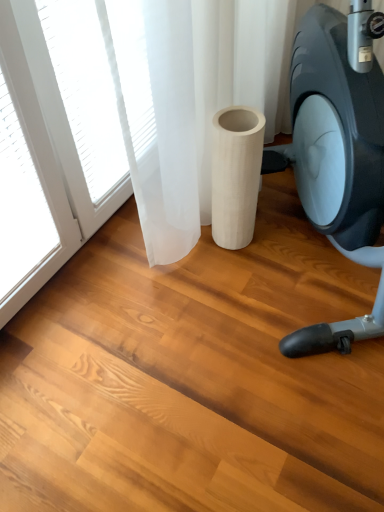
The image size is (384, 512). I want to click on vacant area that lies to the right of white wood cylinder at center, so coord(284,234).